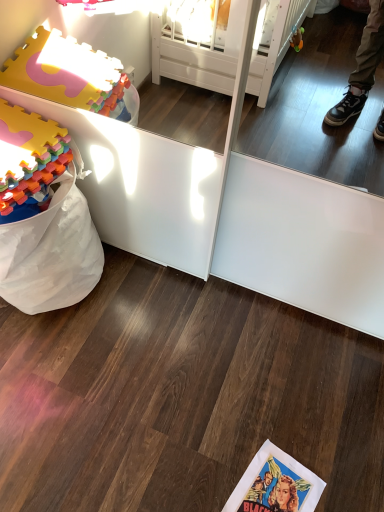
The height and width of the screenshot is (512, 384). What do you see at coordinates (28, 155) in the screenshot?
I see `multicolored foam blocks at left` at bounding box center [28, 155].

What is the approximate height of multicolored foam blocks at left?

It is 8.91 inches.

Locate an element on the screen. multicolored foam blocks at left is located at coordinates tap(28, 155).

In order to face matte paper comic book at lower center, should I rotate leftwards or rightwards?

Rotate your view right by about 10.593°.

Describe the element at coordinates (275, 485) in the screenshot. This screenshot has height=512, width=384. I see `matte paper comic book at lower center` at that location.

This screenshot has width=384, height=512. In order to click on matte paper comic book at lower center in this screenshot , I will do `click(275, 485)`.

I want to click on multicolored foam blocks at left, so click(28, 155).

Would you say matte paper comic book at lower center is to the left or to the right of multicolored foam blocks at left in the picture?

In the image, matte paper comic book at lower center appears on the right side of multicolored foam blocks at left.

Considering the positions of objects matte paper comic book at lower center and multicolored foam blocks at left in the image provided, who is behind, matte paper comic book at lower center or multicolored foam blocks at left?

Positioned behind is matte paper comic book at lower center.

Which is more distant, (242,498) or (66,148)?

Point (66,148)

From the image's perspective, relative to multicolored foam blocks at left, is matte paper comic book at lower center above or below?

Based on their image positions, matte paper comic book at lower center is located beneath multicolored foam blocks at left.

From a real-world perspective, which object rests below the other?

matte paper comic book at lower center is physically lower.

Does matte paper comic book at lower center have a lesser width compared to multicolored foam blocks at left?

Yes.

Is matte paper comic book at lower center taller or shorter than multicolored foam blocks at left?

matte paper comic book at lower center is shorter than multicolored foam blocks at left.

Can you confirm if matte paper comic book at lower center is smaller than multicolored foam blocks at left?

Indeed, matte paper comic book at lower center has a smaller size compared to multicolored foam blocks at left.

Choose the correct answer: Is matte paper comic book at lower center inside multicolored foam blocks at left or outside it?

matte paper comic book at lower center is not enclosed by multicolored foam blocks at left.

Is matte paper comic book at lower center positioned far away from multicolored foam blocks at left?

Indeed, matte paper comic book at lower center is not near multicolored foam blocks at left.

Is matte paper comic book at lower center turned away from multicolored foam blocks at left?

matte paper comic book at lower center is not turned away from multicolored foam blocks at left.

I want to click on comic book lying behind the multicolored foam blocks at left, so click(x=275, y=485).

Does multicolored foam blocks at left appear on the right side of matte paper comic book at lower center?

Incorrect, multicolored foam blocks at left is not on the right side of matte paper comic book at lower center.

Considering their positions, is multicolored foam blocks at left located in front of or behind matte paper comic book at lower center?

Clearly, multicolored foam blocks at left is in front of matte paper comic book at lower center.

Between point (53, 126) and point (272, 481), which one is positioned behind?

The point (53, 126) is more distant.

From the image's perspective, between multicolored foam blocks at left and matte paper comic book at lower center, who is located below?

matte paper comic book at lower center, from the image's perspective.

Consider the image. From a real-world perspective, between multicolored foam blocks at left and matte paper comic book at lower center, who is vertically lower?

In real-world perspective, matte paper comic book at lower center is lower.

Looking at this image, does multicolored foam blocks at left have a lesser width compared to matte paper comic book at lower center?

In fact, multicolored foam blocks at left might be wider than matte paper comic book at lower center.

Between multicolored foam blocks at left and matte paper comic book at lower center, which one has less height?

matte paper comic book at lower center.

Consider the image. Which of these two, multicolored foam blocks at left or matte paper comic book at lower center, is smaller?

Smaller between the two is matte paper comic book at lower center.

Consider the image. Would you say multicolored foam blocks at left is inside or outside matte paper comic book at lower center?

multicolored foam blocks at left cannot be found inside matte paper comic book at lower center.

Is multicolored foam blocks at left placed right next to matte paper comic book at lower center?

No, multicolored foam blocks at left is not touching matte paper comic book at lower center.

Is multicolored foam blocks at left aimed at matte paper comic book at lower center?

No, multicolored foam blocks at left is not facing towards matte paper comic book at lower center.

How different are the orientations of multicolored foam blocks at left and matte paper comic book at lower center in degrees?

There is a 106-degree angle between the facing directions of multicolored foam blocks at left and matte paper comic book at lower center.

Measure the distance between multicolored foam blocks at left and matte paper comic book at lower center.

multicolored foam blocks at left is 3.54 feet from matte paper comic book at lower center.

The height and width of the screenshot is (512, 384). Find the location of `toy located above the matte paper comic book at lower center (from the image's perspective)`. toy located above the matte paper comic book at lower center (from the image's perspective) is located at coordinates (28, 155).

This screenshot has width=384, height=512. Find the location of `comic book below the multicolored foam blocks at left (from the image's perspective)`. comic book below the multicolored foam blocks at left (from the image's perspective) is located at coordinates (275, 485).

The image size is (384, 512). Find the location of `toy located above the matte paper comic book at lower center (from a real-world perspective)`. toy located above the matte paper comic book at lower center (from a real-world perspective) is located at coordinates (28, 155).